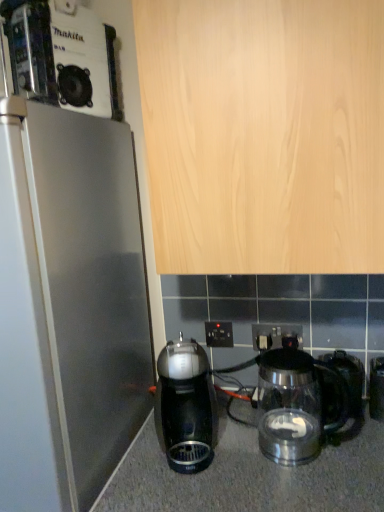
Question: Does metallic silver coffee maker at upper left have a smaller size compared to black plastic electric outlet at center, the first electric outlet viewed from the left?

Choices:
 (A) no
 (B) yes

Answer: (A)

Question: Is metallic silver coffee maker at upper left looking in the opposite direction of black plastic electric outlet at center, the first electric outlet viewed from the left?

Choices:
 (A) yes
 (B) no

Answer: (B)

Question: From a real-world perspective, does metallic silver coffee maker at upper left stand above black plastic electric outlet at center, the 2th electric outlet in the right-to-left sequence?

Choices:
 (A) yes
 (B) no

Answer: (A)

Question: Considering the relative sizes of metallic silver coffee maker at upper left and black plastic electric outlet at center, the first electric outlet viewed from the left, in the image provided, is metallic silver coffee maker at upper left taller than black plastic electric outlet at center, the first electric outlet viewed from the left,?

Choices:
 (A) yes
 (B) no

Answer: (A)

Question: Considering the relative positions of metallic silver coffee maker at upper left and black plastic electric outlet at center, the 2th electric outlet in the right-to-left sequence, in the image provided, is metallic silver coffee maker at upper left behind black plastic electric outlet at center, the 2th electric outlet in the right-to-left sequence,?

Choices:
 (A) no
 (B) yes

Answer: (A)

Question: In terms of width, does black plastic electric outlet at center, the 2th electric outlet in the right-to-left sequence, look wider or thinner when compared to transparent glass kettle at lower center, marked as the 2th kitchen appliance in a left-to-right arrangement?

Choices:
 (A) wide
 (B) thin

Answer: (B)

Question: Is point (215, 346) positioned closer to the camera than point (342, 385)?

Choices:
 (A) farther
 (B) closer

Answer: (A)

Question: From the image's perspective, is black plastic electric outlet at center, the 2th electric outlet in the right-to-left sequence, located above or below transparent glass kettle at lower center, marked as the 2th kitchen appliance in a left-to-right arrangement?

Choices:
 (A) below
 (B) above

Answer: (B)

Question: Is black plastic electric outlet at center, the first electric outlet viewed from the left, taller or shorter than transparent glass kettle at lower center, marked as the 2th kitchen appliance in a left-to-right arrangement?

Choices:
 (A) tall
 (B) short

Answer: (B)

Question: In terms of size, does black plastic electric outlet at center, the 2th electric outlet in the right-to-left sequence, appear bigger or smaller than shiny black coffee maker at center, the first kitchen appliance from the left?

Choices:
 (A) small
 (B) big

Answer: (A)

Question: In terms of height, does black plastic electric outlet at center, the first electric outlet viewed from the left, look taller or shorter compared to shiny black coffee maker at center, the second kitchen appliance in the right-to-left sequence?

Choices:
 (A) short
 (B) tall

Answer: (A)

Question: Would you say black plastic electric outlet at center, the 2th electric outlet in the right-to-left sequence, is inside or outside shiny black coffee maker at center, the first kitchen appliance from the left?

Choices:
 (A) inside
 (B) outside

Answer: (B)

Question: Would you say black plastic electric outlet at center, the 2th electric outlet in the right-to-left sequence, is to the left or to the right of shiny black coffee maker at center, the second kitchen appliance in the right-to-left sequence, in the picture?

Choices:
 (A) right
 (B) left

Answer: (A)

Question: Does point [x=180, y=388] appear closer or farther from the camera than point [x=210, y=346]?

Choices:
 (A) closer
 (B) farther

Answer: (A)

Question: From a real-world perspective, relative to black plastic electric outlet at center, the 2th electric outlet in the right-to-left sequence, is shiny black coffee maker at center, the second kitchen appliance in the right-to-left sequence, vertically above or below?

Choices:
 (A) above
 (B) below

Answer: (B)